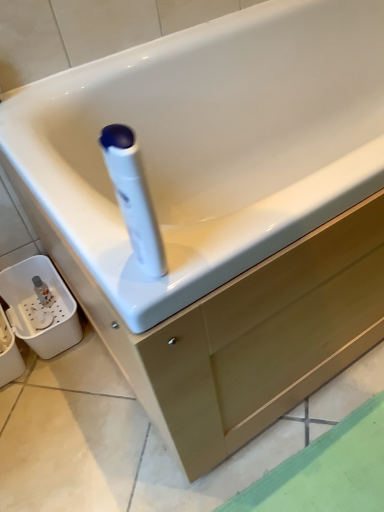
Question: Can you confirm if matte wood drawer at center is shorter than white glossy cleaning product at center?

Choices:
 (A) no
 (B) yes

Answer: (B)

Question: Is matte wood drawer at center bigger than white glossy cleaning product at center?

Choices:
 (A) no
 (B) yes

Answer: (B)

Question: Is matte wood drawer at center behind white glossy cleaning product at center?

Choices:
 (A) yes
 (B) no

Answer: (A)

Question: Considering the relative sizes of matte wood drawer at center and white glossy cleaning product at center in the image provided, is matte wood drawer at center wider than white glossy cleaning product at center?

Choices:
 (A) no
 (B) yes

Answer: (B)

Question: From the image's perspective, is matte wood drawer at center beneath white glossy cleaning product at center?

Choices:
 (A) no
 (B) yes

Answer: (B)

Question: Is matte wood drawer at center located outside white glossy cleaning product at center?

Choices:
 (A) yes
 (B) no

Answer: (A)

Question: Is white glossy cleaning product at center wider than matte wood drawer at center?

Choices:
 (A) yes
 (B) no

Answer: (B)

Question: From the image's perspective, is white glossy cleaning product at center located beneath matte wood drawer at center?

Choices:
 (A) no
 (B) yes

Answer: (A)

Question: From a real-world perspective, is white glossy cleaning product at center located higher than matte wood drawer at center?

Choices:
 (A) yes
 (B) no

Answer: (A)

Question: Is white glossy cleaning product at center next to matte wood drawer at center and touching it?

Choices:
 (A) yes
 (B) no

Answer: (B)

Question: Is the position of white glossy cleaning product at center more distant than that of matte wood drawer at center?

Choices:
 (A) no
 (B) yes

Answer: (A)

Question: Is white glossy cleaning product at center thinner than matte wood drawer at center?

Choices:
 (A) yes
 (B) no

Answer: (A)

Question: Do you think white glossy cleaning product at center is within matte wood drawer at center, or outside of it?

Choices:
 (A) inside
 (B) outside

Answer: (B)